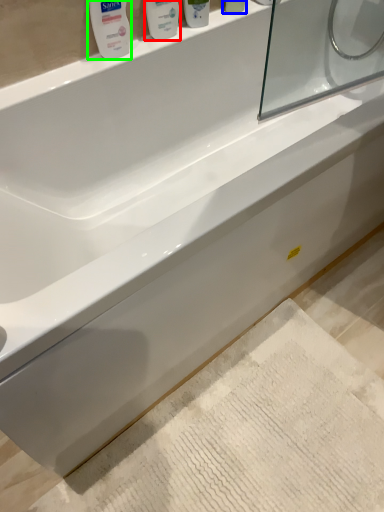
Question: Which object is positioned farthest from mouthwash (highlighted by a red box)? Select from mouthwash (highlighted by a blue box) and mouthwash (highlighted by a green box).

Choices:
 (A) mouthwash
 (B) mouthwash

Answer: (A)